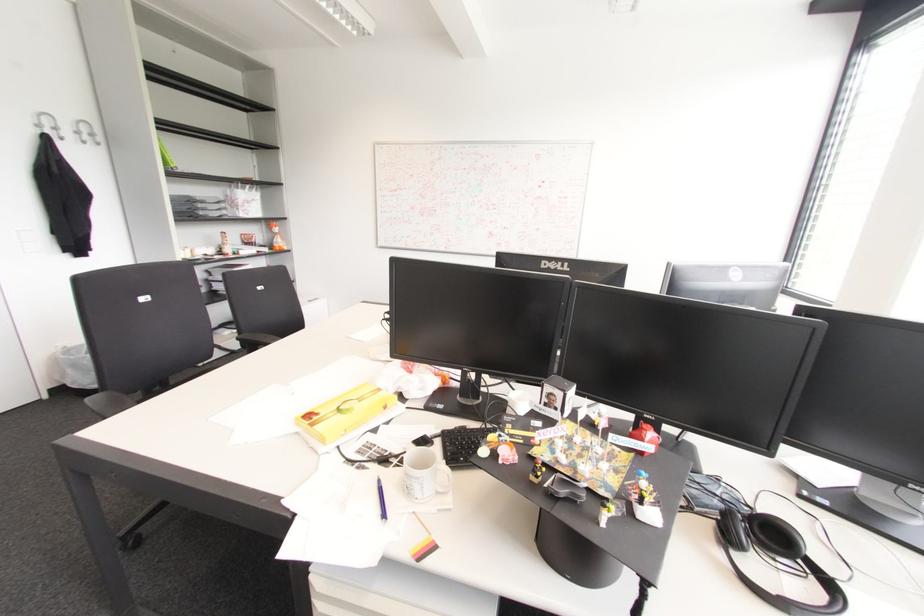
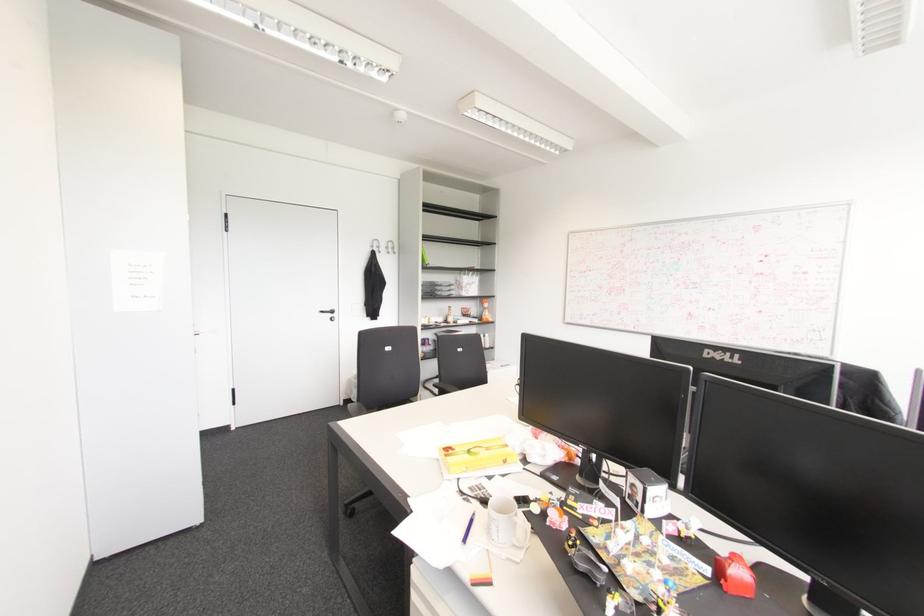
In the second image, find the point that corresponds to [440,488] in the first image.

(515, 543)